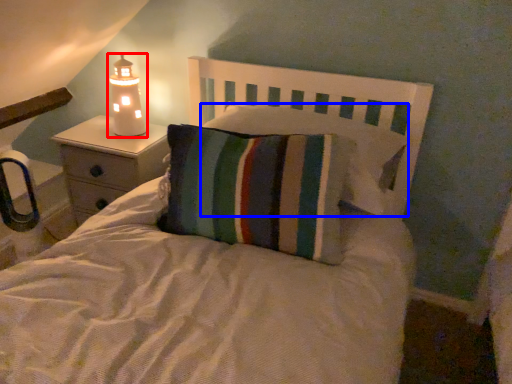
Question: Which object appears closest to the camera in this image, lamp (highlighted by a red box) or pillow (highlighted by a blue box)?

Choices:
 (A) lamp
 (B) pillow

Answer: (B)